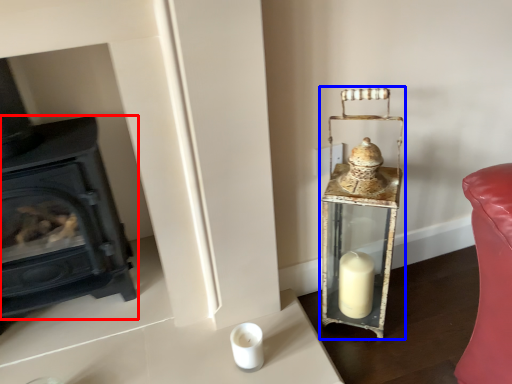
Question: Which of the following is the farthest to the observer, wood burning stove (highlighted by a red box) or table lamp (highlighted by a blue box)?

Choices:
 (A) wood burning stove
 (B) table lamp

Answer: (B)